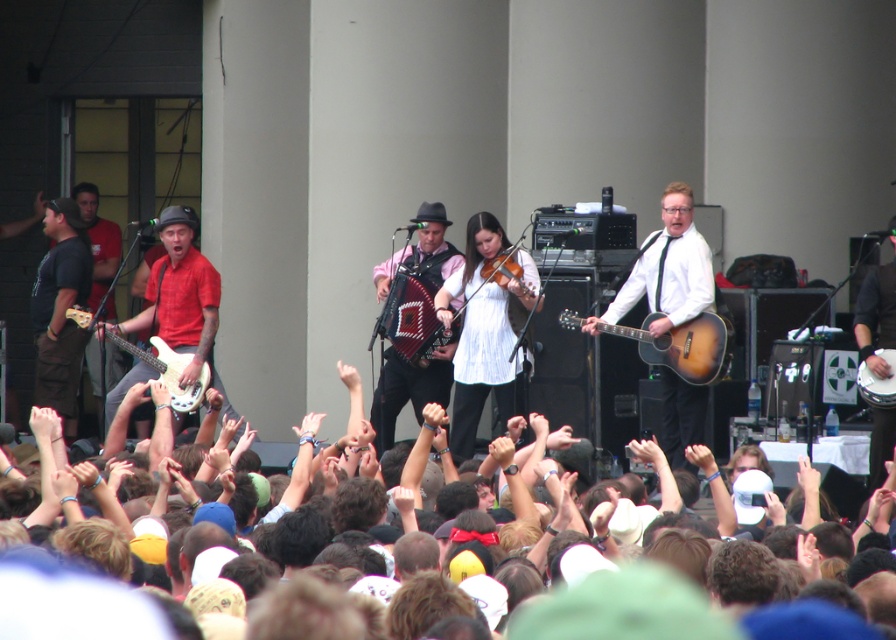
Question: Which point appears closest to the camera in this image?

Choices:
 (A) (283, 634)
 (B) (698, 241)
 (C) (873, 381)
 (D) (423, 234)

Answer: (A)

Question: Which of these objects is positioned farthest from the white drum at center?

Choices:
 (A) satin wood guitar at center
 (B) wooden violin at center
 (C) knitted wool accordion at center
 (D) matte brown guitar at center

Answer: (C)

Question: Is white cotton crowd at center to the right of matte brown guitar at center from the viewer's perspective?

Choices:
 (A) yes
 (B) no

Answer: (B)

Question: Which point is closer to the camera?

Choices:
 (A) satin wood guitar at center
 (B) white cotton crowd at center
 (C) white drum at center
 (D) matte pink shirt at center

Answer: (B)

Question: Does satin wood guitar at center have a larger size compared to white glossy electric guitar at left?

Choices:
 (A) no
 (B) yes

Answer: (B)

Question: Can you confirm if white cotton crowd at center is thinner than white drum at center?

Choices:
 (A) yes
 (B) no

Answer: (B)